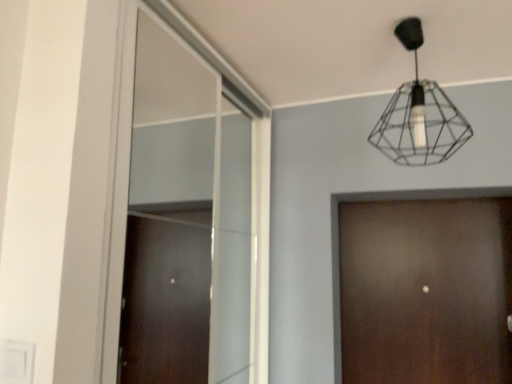
Question: Choose the correct answer: Is wireframe black lamp at upper center inside brown wood door at center or outside it?

Choices:
 (A) inside
 (B) outside

Answer: (B)

Question: From the image's perspective, is wireframe black lamp at upper center above or below brown wood door at center?

Choices:
 (A) above
 (B) below

Answer: (A)

Question: Which of these objects is positioned closest to the brown wood door at center?

Choices:
 (A) wireframe black lamp at upper center
 (B) clear glass window at center

Answer: (A)

Question: Estimate the real-world distances between objects in this image. Which object is farther from the clear glass window at center?

Choices:
 (A) wireframe black lamp at upper center
 (B) brown wood door at center

Answer: (A)